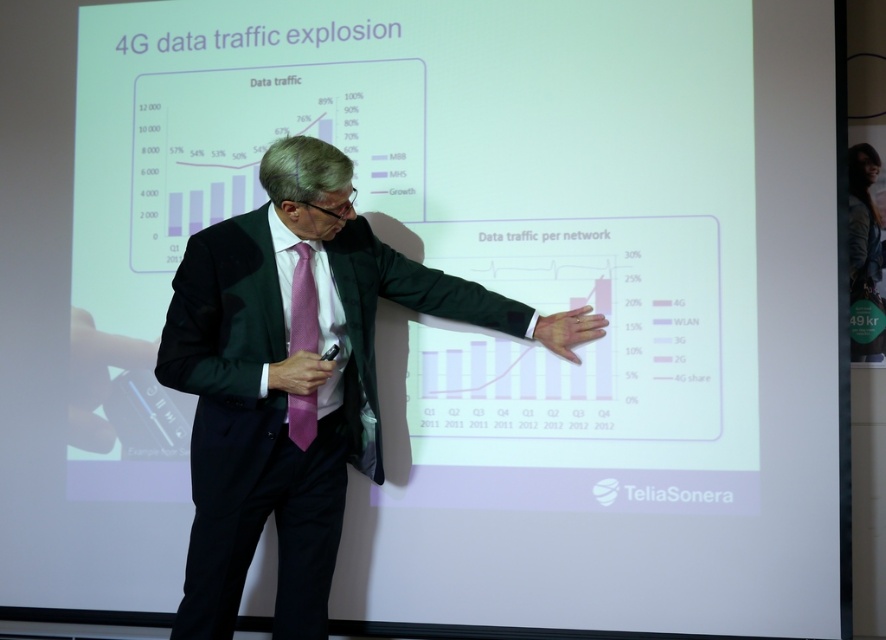
Question: Is matte green suit at center wider than pink textured tie at center?

Choices:
 (A) no
 (B) yes

Answer: (B)

Question: Is matte green suit at center to the left of pink textured tie at center from the viewer's perspective?

Choices:
 (A) no
 (B) yes

Answer: (A)

Question: Does matte green suit at center have a lesser width compared to pink textured tie at center?

Choices:
 (A) yes
 (B) no

Answer: (B)